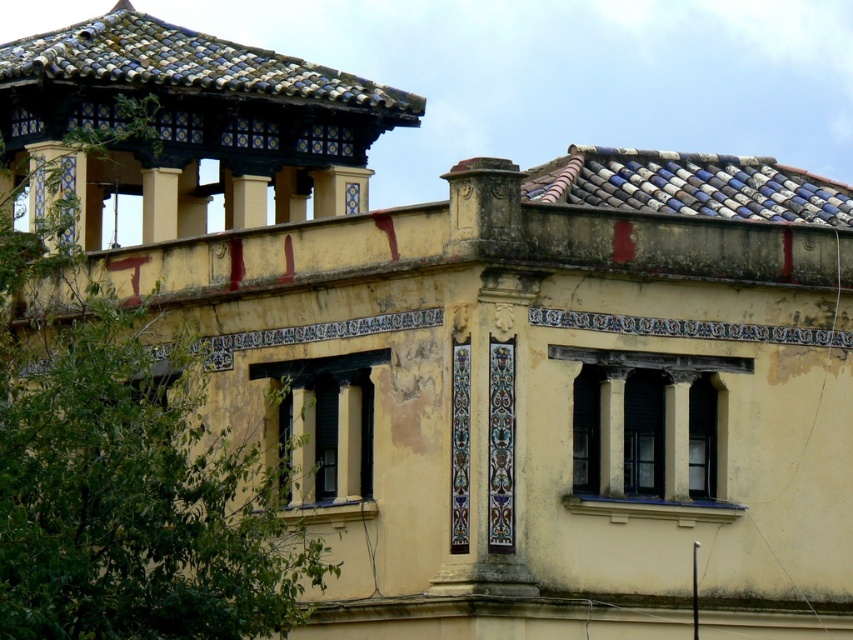
You are an architect examining the building. You notice the blue and white tiled roof at upper left and the blue and white glazed tiles at upper right. Which of these two features is positioned higher up on the building?

The blue and white tiled roof at upper left is taller than blue and white glazed tiles at upper right, so the blue and white tiled roof at upper left is positioned higher up on the building.

You are an architect assessing the building facade. You need to compare the widths of the blue and white tiled roof at upper left and the blue and white glazed tiles at upper right. Which one has a greater width?

The blue and white tiled roof at upper left has a larger width than the blue and white glazed tiles at upper right according to the description.